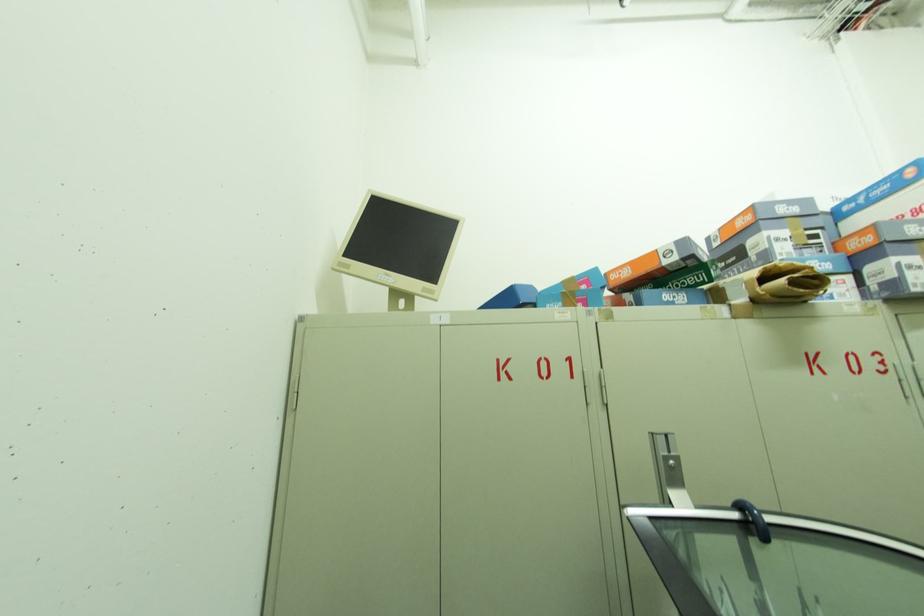
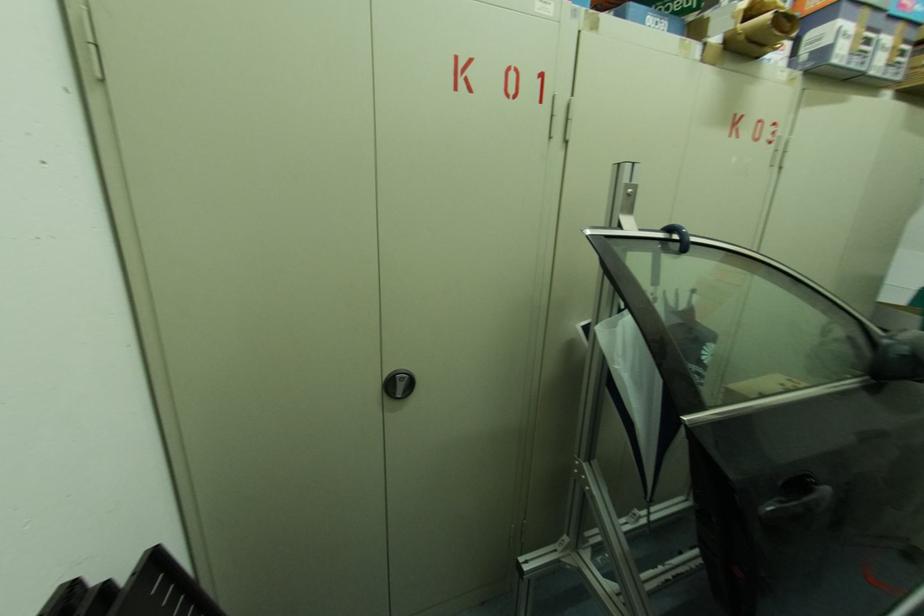
How did the camera likely rotate?

The camera's rotation is toward right-down.